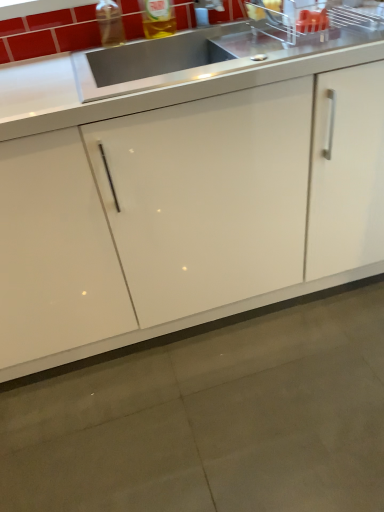
You are a GUI agent. You are given a task and a screenshot of the screen. Output one action in this format:
    pyautogui.click(x=<x>, y=<y>)
    Task: Click on the free space to the left of translucent plastic bottle at upper center
    This screenshot has width=384, height=512.
    Given the screenshot: What is the action you would take?
    pyautogui.click(x=119, y=45)